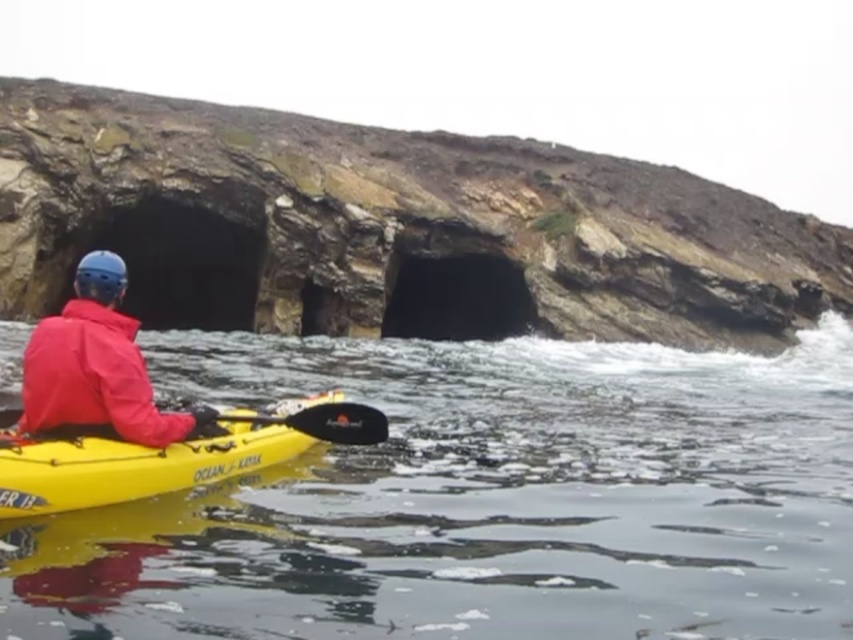
Between point (490, 481) and point (115, 452), which one is positioned behind?

The point (490, 481) is more distant.

Does clear water at lower center appear under yellow plastic kayak at lower left?

No.

Is point (306, 492) positioned in front of point (128, 456)?

No, it is not.

Where is `clear water at lower center`? This screenshot has height=640, width=853. clear water at lower center is located at coordinates (480, 499).

In the scene shown: Is clear water at lower center wider than matte red jacket at center?

Yes.

At what (x,y) coordinates should I click in order to perform the action: click on clear water at lower center. Please return your answer as a coordinate pair (x, y). The height and width of the screenshot is (640, 853). Looking at the image, I should click on (480, 499).

Is point (764, 573) behind point (352, 428)?

No, (764, 573) is closer to viewer.

Based on the photo, does clear water at lower center appear over black rubber paddle at center?

Yes, clear water at lower center is above black rubber paddle at center.

This screenshot has height=640, width=853. I want to click on clear water at lower center, so click(x=480, y=499).